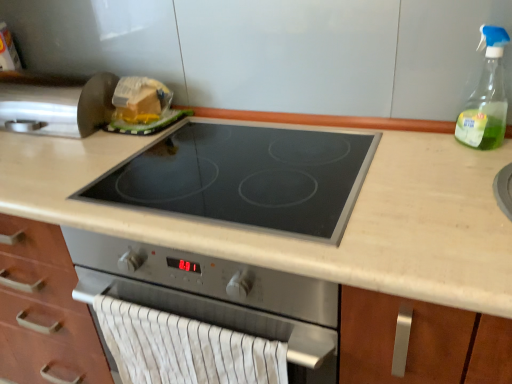
Find the location of a particular element. The image size is (512, 384). beige laminate countertop at center is located at coordinates (302, 239).

This screenshot has height=384, width=512. Describe the element at coordinates (140, 100) in the screenshot. I see `translucent plastic cheese at upper left` at that location.

Locate an element on the screen. clear glass spray bottle at upper right is located at coordinates (486, 97).

From a real-world perspective, is translucent plastic cheese at upper left positioned above or below beige laminate countertop at center?

From a real-world perspective, translucent plastic cheese at upper left is physically above beige laminate countertop at center.

Looking at this image, is translucent plastic cheese at upper left aimed at beige laminate countertop at center?

No, translucent plastic cheese at upper left is not oriented towards beige laminate countertop at center.

You are a GUI agent. You are given a task and a screenshot of the screen. Output one action in this format:
    pyautogui.click(x=<x>, y=<y>)
    Task: Click on the food that is above the beige laminate countertop at center (from a real-world perspective)
    This screenshot has width=512, height=384.
    Given the screenshot: What is the action you would take?
    pyautogui.click(x=140, y=100)

Considering the positions of objects translucent plastic cheese at upper left and beige laminate countertop at center in the image provided, who is more to the right, translucent plastic cheese at upper left or beige laminate countertop at center?

From the viewer's perspective, beige laminate countertop at center appears more on the right side.

Which of these two, beige laminate countertop at center or metallic silver knife at upper left, is smaller?

Smaller between the two is metallic silver knife at upper left.

Considering the relative positions of beige laminate countertop at center and metallic silver knife at upper left in the image provided, is beige laminate countertop at center to the right of metallic silver knife at upper left from the viewer's perspective?

Correct, you'll find beige laminate countertop at center to the right of metallic silver knife at upper left.

Is point (398, 149) positioned after point (3, 110)?

That is False.

From the picture: Is beige laminate countertop at center oriented away from metallic silver knife at upper left?

beige laminate countertop at center is not turned away from metallic silver knife at upper left.

Does black glass cooktop at center turn towards translucent plastic cheese at upper left?

No, black glass cooktop at center is not oriented towards translucent plastic cheese at upper left.

Would you say black glass cooktop at center is outside translucent plastic cheese at upper left?

Absolutely, black glass cooktop at center is external to translucent plastic cheese at upper left.

In the scene shown: Considering the relative positions of black glass cooktop at center and translucent plastic cheese at upper left in the image provided, is black glass cooktop at center to the left or to the right of translucent plastic cheese at upper left?

black glass cooktop at center is to the right of translucent plastic cheese at upper left.

From the image's perspective, does black glass cooktop at center appear higher than translucent plastic cheese at upper left?

Actually, black glass cooktop at center appears below translucent plastic cheese at upper left in the image.

From the picture: Considering the sizes of objects metallic silver knife at upper left and clear glass spray bottle at upper right in the image provided, who is smaller, metallic silver knife at upper left or clear glass spray bottle at upper right?

Smaller between the two is clear glass spray bottle at upper right.

Is metallic silver knife at upper left next to clear glass spray bottle at upper right and touching it?

No, metallic silver knife at upper left is not beside clear glass spray bottle at upper right.

Can you confirm if metallic silver knife at upper left is taller than clear glass spray bottle at upper right?

No, metallic silver knife at upper left is not taller than clear glass spray bottle at upper right.

In the scene shown: Is metallic silver knife at upper left to the left or to the right of clear glass spray bottle at upper right in the image?

Based on their positions, metallic silver knife at upper left is located to the left of clear glass spray bottle at upper right.

Considering the relative sizes of white striped fabric hand towel at lower center and black glass cooktop at center in the image provided, is white striped fabric hand towel at lower center wider than black glass cooktop at center?

In fact, white striped fabric hand towel at lower center might be narrower than black glass cooktop at center.

Is white striped fabric hand towel at lower center completely or partially outside of black glass cooktop at center?

white striped fabric hand towel at lower center is positioned outside black glass cooktop at center.

Considering the sizes of objects white striped fabric hand towel at lower center and black glass cooktop at center in the image provided, who is taller, white striped fabric hand towel at lower center or black glass cooktop at center?

white striped fabric hand towel at lower center.

From the image's perspective, is white striped fabric hand towel at lower center positioned above or below black glass cooktop at center?

white striped fabric hand towel at lower center is below black glass cooktop at center.

From a real-world perspective, who is located higher, white striped fabric hand towel at lower center or translucent plastic cheese at upper left?

From a 3D spatial view, translucent plastic cheese at upper left is above.

Does point (154, 379) lie behind point (140, 112)?

No, it is not.

Is white striped fabric hand towel at lower center situated inside translucent plastic cheese at upper left or outside?

white striped fabric hand towel at lower center cannot be found inside translucent plastic cheese at upper left.

In the scene shown: Which is in front, white striped fabric hand towel at lower center or translucent plastic cheese at upper left?

Positioned in front is white striped fabric hand towel at lower center.

Is translucent plastic cheese at upper left bigger or smaller than metallic silver knife at upper left?

translucent plastic cheese at upper left is smaller than metallic silver knife at upper left.

From the image's perspective, is translucent plastic cheese at upper left located above or below metallic silver knife at upper left?

translucent plastic cheese at upper left is below metallic silver knife at upper left.

Could you tell me if translucent plastic cheese at upper left is turned towards metallic silver knife at upper left?

No, translucent plastic cheese at upper left is not aimed at metallic silver knife at upper left.

Does point (135, 94) come behind point (61, 121)?

Yes, it is.

Locate an element on the screen. countertop on the right of the translucent plastic cheese at upper left is located at coordinates (302, 239).

Locate an element on the screen. This screenshot has height=384, width=512. countertop that is under the metallic silver knife at upper left (from a real-world perspective) is located at coordinates (302, 239).

Which object lies nearer to the anchor point white striped fabric hand towel at lower center, black glass cooktop at center or metallic silver knife at upper left?

Among the two, black glass cooktop at center is located nearer to white striped fabric hand towel at lower center.

Based on their spatial positions, is black glass cooktop at center or metallic silver knife at upper left closer to clear glass spray bottle at upper right?

black glass cooktop at center is closer to clear glass spray bottle at upper right.

Which object lies further to the anchor point black glass cooktop at center, white striped fabric hand towel at lower center or translucent plastic cheese at upper left?

translucent plastic cheese at upper left lies further to black glass cooktop at center than the other object.

Considering their positions, is translucent plastic cheese at upper left positioned further to black glass cooktop at center than clear glass spray bottle at upper right?

clear glass spray bottle at upper right is further to black glass cooktop at center.

Considering their positions, is metallic silver knife at upper left positioned closer to beige laminate countertop at center than clear glass spray bottle at upper right?

The object closer to beige laminate countertop at center is clear glass spray bottle at upper right.

When comparing their distances from clear glass spray bottle at upper right, does metallic silver knife at upper left or beige laminate countertop at center seem further?

The object further to clear glass spray bottle at upper right is metallic silver knife at upper left.

Based on their spatial positions, is metallic silver knife at upper left or beige laminate countertop at center further from white striped fabric hand towel at lower center?

Among the two, metallic silver knife at upper left is located further to white striped fabric hand towel at lower center.

Based on their spatial positions, is beige laminate countertop at center or black glass cooktop at center closer to white striped fabric hand towel at lower center?

beige laminate countertop at center lies closer to white striped fabric hand towel at lower center than the other object.

Find the location of `countertop between metallic silver knife at upper left and clear glass spray bottle at upper right`. countertop between metallic silver knife at upper left and clear glass spray bottle at upper right is located at coordinates (302, 239).

Identify the location of gas stove between metallic silver knife at upper left and white striped fabric hand towel at lower center in the up-down direction. (246, 178).

The height and width of the screenshot is (384, 512). I want to click on countertop situated between translucent plastic cheese at upper left and clear glass spray bottle at upper right from left to right, so click(302, 239).

Where is `hand towel between beige laminate countertop at center and metallic silver knife at upper left from front to back`? hand towel between beige laminate countertop at center and metallic silver knife at upper left from front to back is located at coordinates [x=184, y=348].